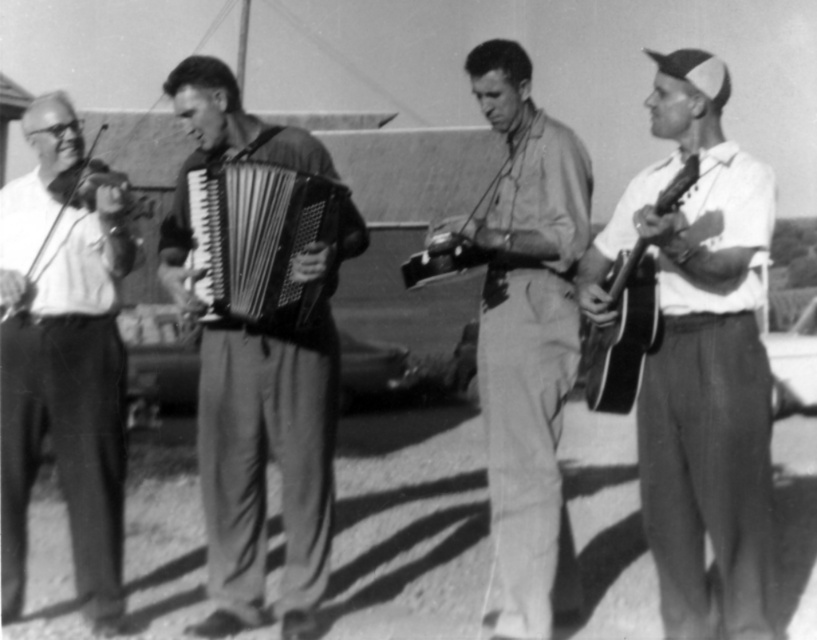
Is metallic accordion at center smaller than wooden acoustic guitar at right?

Yes, metallic accordion at center is smaller than wooden acoustic guitar at right.

From the picture: Does metallic accordion at center appear under wooden acoustic guitar at right?

No, metallic accordion at center is not below wooden acoustic guitar at right.

The width and height of the screenshot is (817, 640). Identify the location of metallic accordion at center. (257, 240).

Is point (25, 280) farther from viewer compared to point (614, 301)?

Yes, it is behind point (614, 301).

Which is behind, point (47, 196) or point (592, 364)?

The point (47, 196) is more distant.

This screenshot has width=817, height=640. Find the location of `smooth wood violin at left`. smooth wood violin at left is located at coordinates (63, 360).

Locate an element on the screen. The height and width of the screenshot is (640, 817). smooth wood violin at left is located at coordinates (63, 360).

Who is more forward, (654, 234) or (190, 266)?

Point (654, 234)

Is the position of white matte guitar at right less distant than that of metallic accordion at center?

Yes.

Does point (708, 236) lie behind point (327, 236)?

No, it is in front of (327, 236).

Where is `white matte guitar at right`? white matte guitar at right is located at coordinates (701, 358).